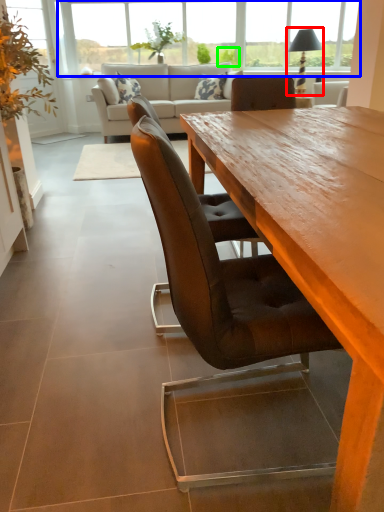
Question: Considering the real-world distances, which object is closest to lamp (highlighted by a red box)? window (highlighted by a blue box) or plant (highlighted by a green box).

Choices:
 (A) window
 (B) plant

Answer: (B)